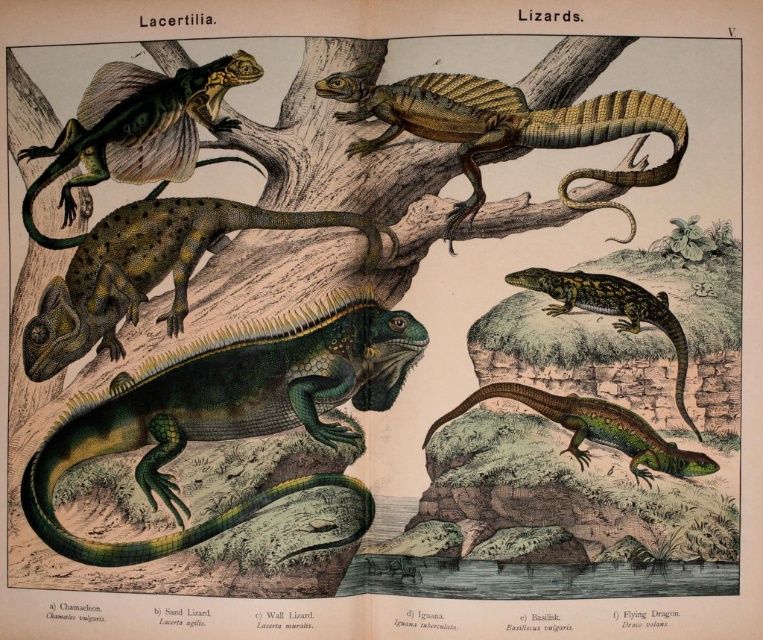
Is point (26, 346) closer to camera compared to point (583, 406)?

No, (26, 346) is further to viewer.

Who is lower down, spotted green scales at center or green glossy lizard at lower right?

Positioned lower is green glossy lizard at lower right.

Is point (108, 266) in front of point (617, 412)?

No.

Image resolution: width=763 pixels, height=640 pixels. In order to click on spotted green scales at center in this screenshot , I will do `click(147, 269)`.

Does spotted green scales at center have a larger size compared to shiny green scales at upper left?

Yes.

Which of these two, spotted green scales at center or shiny green scales at upper left, stands shorter?

spotted green scales at center is shorter.

The image size is (763, 640). In order to click on spotted green scales at center in this screenshot , I will do `click(147, 269)`.

Identify the location of spotted green scales at center. (147, 269).

Who is positioned more to the left, green scaly iguana at center or shiny green lizard at upper right?

Positioned to the left is green scaly iguana at center.

Which of these two, green scaly iguana at center or shiny green lizard at upper right, stands taller?

green scaly iguana at center is taller.

This screenshot has height=640, width=763. I want to click on green scaly iguana at center, so click(x=227, y=419).